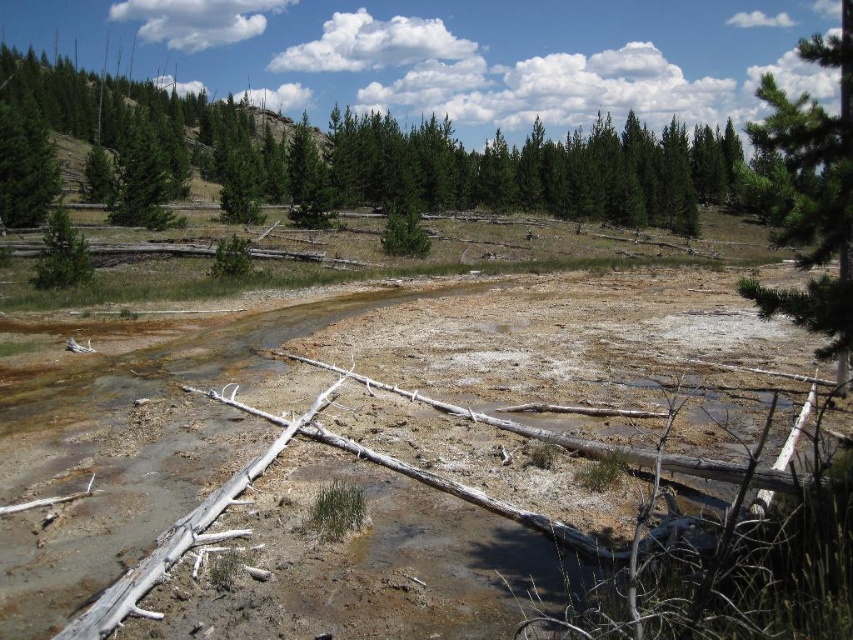
You are a hiker trying to cross the dried stream bed. You notice the brown clayey mud at center and the green matte tree at left. Which object would you avoid stepping on to prevent sinking?

You should avoid stepping on the brown clayey mud at center because it has a larger size than the green matte tree at left, making it more prone to sinking.

You are a hiker trying to cross the dried stream bed. You notice the brown clayey mud at center and the green matte tree at left. Which direction should you head towards to avoid the mud?

The green matte tree at left is located to the left of the brown clayey mud at center. To avoid the mud, head towards the direction of the green matte tree at left.